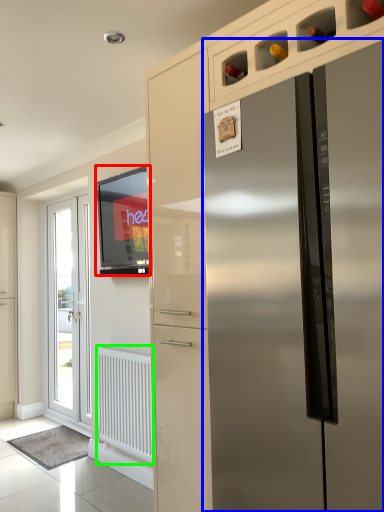
Question: Estimate the real-world distances between objects in this image. Which object is closer to window screen (highlighted by a red box), refrigerator (highlighted by a blue box) or radiator (highlighted by a green box)?

Choices:
 (A) refrigerator
 (B) radiator

Answer: (B)